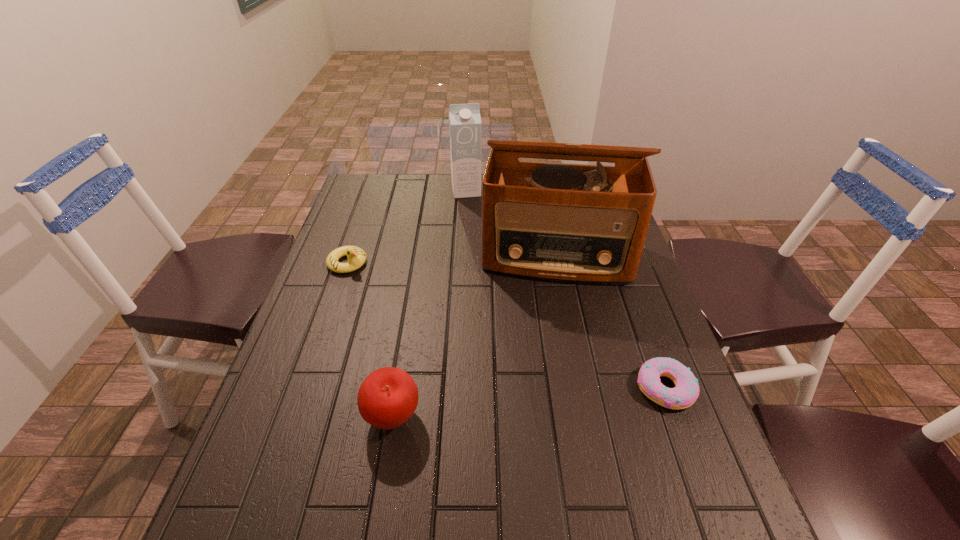
Identify the location of free space on the desktop that is between the third shortest object and the doughnut and is positioned on the front panel of the tallest object. This screenshot has width=960, height=540. (556, 399).

At what (x,y) coordinates should I click in order to perform the action: click on vacant spot on the desktop that is between the fourth object from right to left and the shortest object and is positioned on the face of the fourth tallest object. Please return your answer as a coordinate pair (x, y). Looking at the image, I should click on (513, 404).

At what (x,y) coordinates should I click in order to perform the action: click on free space on the desktop that is between the second object from left to right and the doughnut and is positioned on the front label of the carton. Please return your answer as a coordinate pair (x, y). This screenshot has width=960, height=540. Looking at the image, I should click on (510, 404).